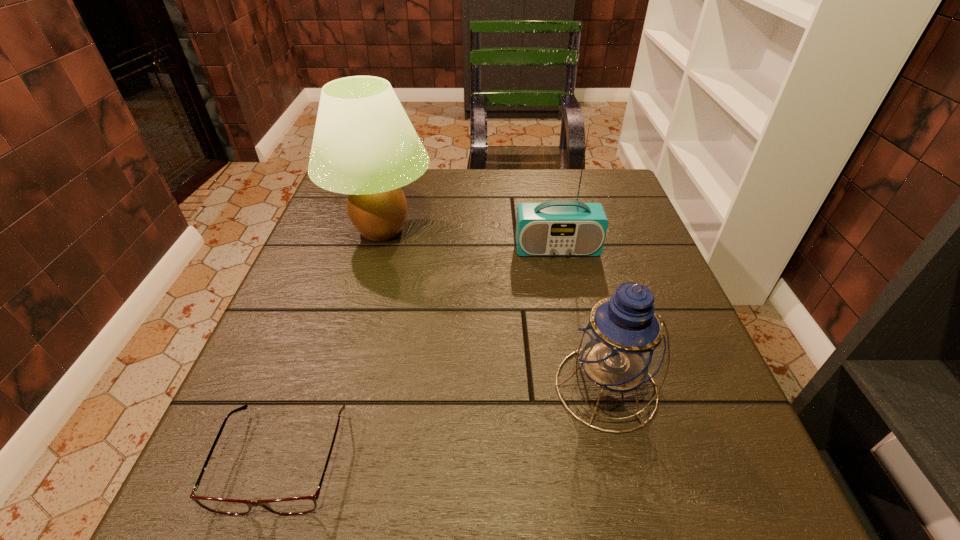
Locate an element on the screen. This screenshot has height=540, width=960. spectacles located at the left edge is located at coordinates (305, 504).

At what (x,y) coordinates should I click in order to perform the action: click on radio receiver located at the right edge. Please return your answer as a coordinate pair (x, y). Looking at the image, I should click on (559, 227).

This screenshot has width=960, height=540. I want to click on lantern located in the right edge section of the desktop, so click(x=620, y=344).

Locate an element on the screen. The height and width of the screenshot is (540, 960). object that is at the far left corner is located at coordinates (364, 145).

Where is `object at the near left corner`? The height and width of the screenshot is (540, 960). object at the near left corner is located at coordinates (305, 504).

Identify the location of free location at the far edge of the desktop. This screenshot has width=960, height=540. (450, 180).

In the image, there is a desktop. At what (x,y) coordinates should I click in order to perform the action: click on vacant space at the left edge. Please return your answer as a coordinate pair (x, y). This screenshot has width=960, height=540. Looking at the image, I should click on [x=352, y=255].

The height and width of the screenshot is (540, 960). In the image, there is a desktop. In order to click on free space at the right edge in this screenshot , I will do `click(627, 220)`.

Locate an element on the screen. free region at the near left corner of the desktop is located at coordinates (209, 474).

Where is `free region at the far right corner of the desktop`? The width and height of the screenshot is (960, 540). free region at the far right corner of the desktop is located at coordinates (585, 176).